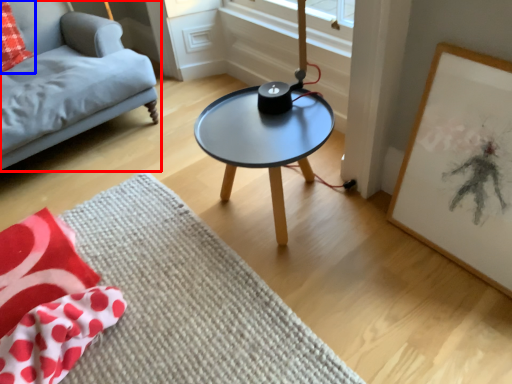
Question: Which object appears farthest to the camera in this image, studio couch (highlighted by a red box) or throw pillow (highlighted by a blue box)?

Choices:
 (A) studio couch
 (B) throw pillow

Answer: (B)